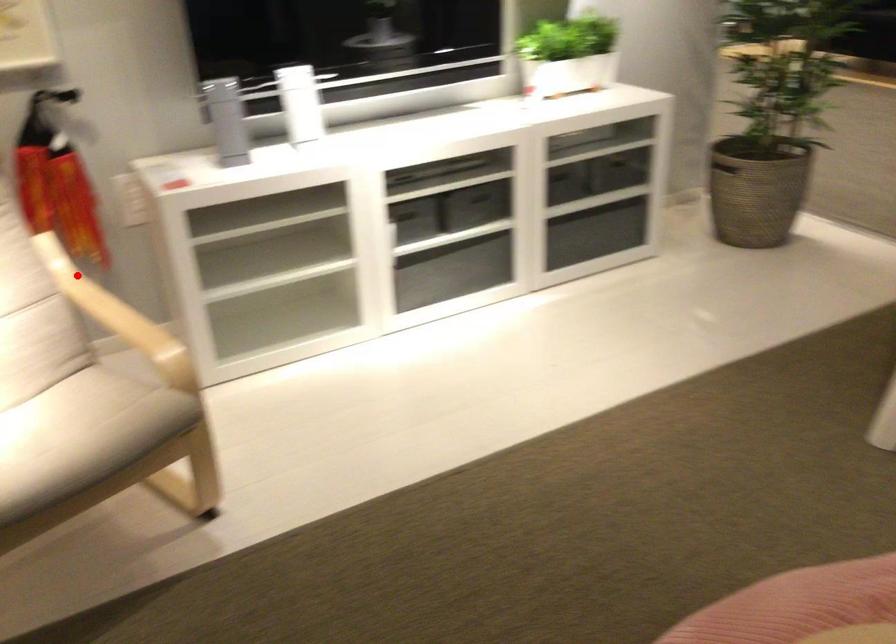
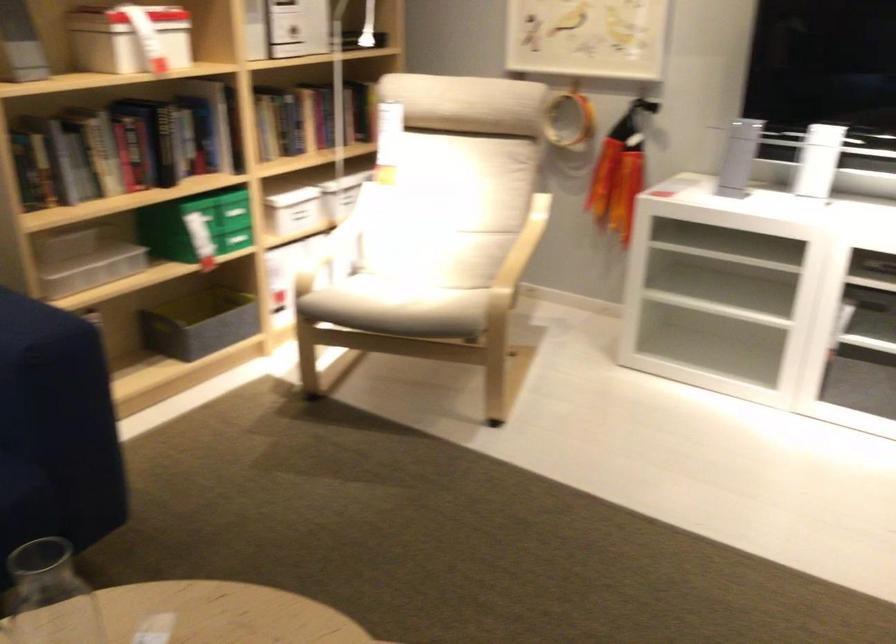
Find the pixel in the second image that matches the highlighted location in the first image.

(536, 223)